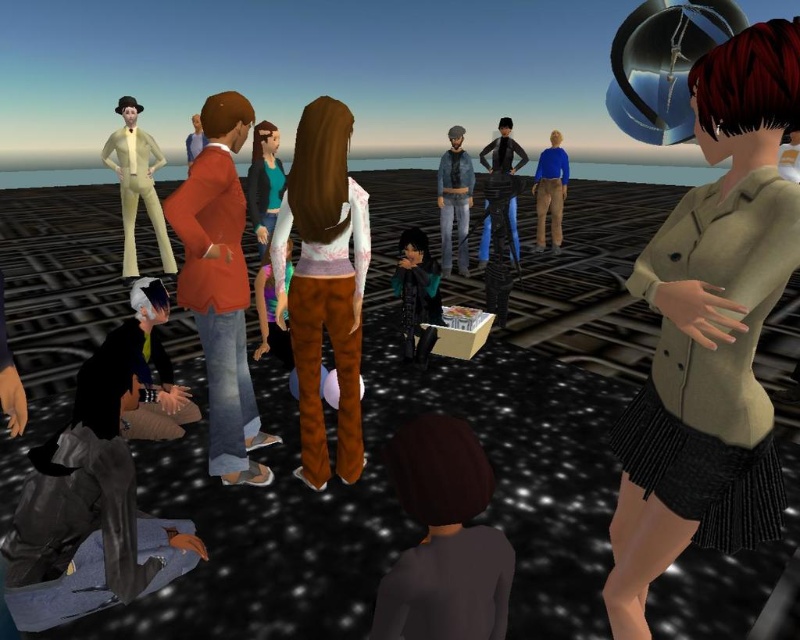
Question: Among these points, which one is nearest to the camera?

Choices:
 (A) (302, 179)
 (B) (148, 289)
 (C) (750, 432)

Answer: (C)

Question: Does matte teal sweater at center appear on the left side of shiny black pants at center?

Choices:
 (A) no
 (B) yes

Answer: (B)

Question: Among these points, which one is nearest to the camera?

Choices:
 (A) (200, 136)
 (B) (512, 236)
 (C) (262, 177)

Answer: (C)

Question: Is matte olive green jacket at center to the left of orange fabric jacket at center from the viewer's perspective?

Choices:
 (A) yes
 (B) no

Answer: (B)

Question: Does shiny black jacket at center have a smaller size compared to denim jeans at center?

Choices:
 (A) no
 (B) yes

Answer: (B)

Question: Among these points, which one is nearest to the camera?

Choices:
 (A) (366, 260)
 (B) (458, 230)
 (C) (193, 236)

Answer: (C)